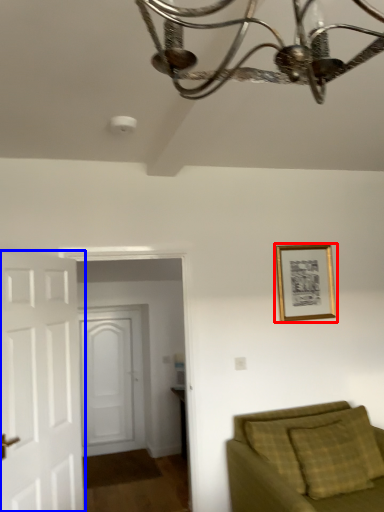
Question: Which object appears closest to the camera in this image, picture frame (highlighted by a red box) or door (highlighted by a blue box)?

Choices:
 (A) picture frame
 (B) door

Answer: (B)